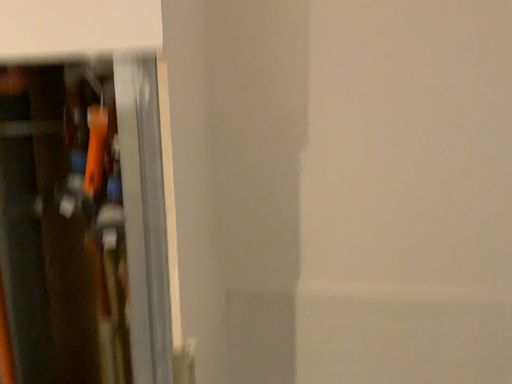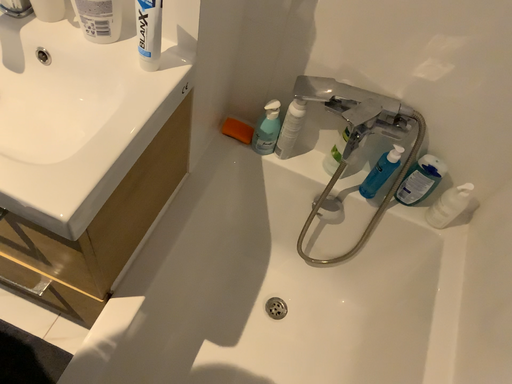
Question: Which way did the camera rotate in the video?

Choices:
 (A) rotated right
 (B) rotated left

Answer: (B)